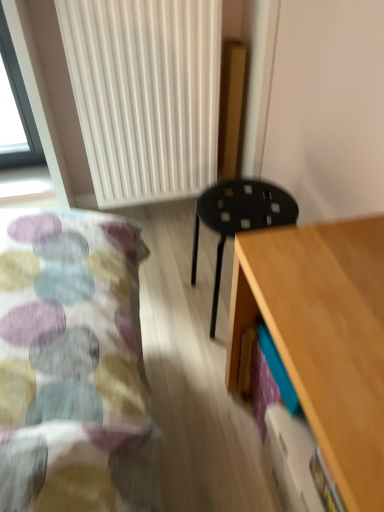
Question: Is white ribbed radiator at upper center positioned with its back to light wood desk at lower right?

Choices:
 (A) yes
 (B) no

Answer: (B)

Question: Can light wood desk at lower right be found inside white ribbed radiator at upper center?

Choices:
 (A) no
 (B) yes

Answer: (A)

Question: Does white ribbed radiator at upper center come behind light wood desk at lower right?

Choices:
 (A) no
 (B) yes

Answer: (B)

Question: Does white ribbed radiator at upper center appear on the right side of light wood desk at lower right?

Choices:
 (A) yes
 (B) no

Answer: (B)

Question: Is white ribbed radiator at upper center to the left of light wood desk at lower right from the viewer's perspective?

Choices:
 (A) no
 (B) yes

Answer: (B)

Question: From a real-world perspective, is white ribbed radiator at upper center physically located above or below light wood desk at lower right?

Choices:
 (A) below
 (B) above

Answer: (B)

Question: Is white ribbed radiator at upper center inside the boundaries of light wood desk at lower right, or outside?

Choices:
 (A) outside
 (B) inside

Answer: (A)

Question: Does point (175, 15) appear closer or farther from the camera than point (369, 343)?

Choices:
 (A) farther
 (B) closer

Answer: (A)

Question: In the image, is white ribbed radiator at upper center positioned in front of or behind light wood desk at lower right?

Choices:
 (A) behind
 (B) front

Answer: (A)

Question: Is light wood desk at lower right wider or thinner than white ribbed radiator at upper center?

Choices:
 (A) thin
 (B) wide

Answer: (B)

Question: Considering the positions of point (355, 268) and point (185, 86), is point (355, 268) closer or farther from the camera than point (185, 86)?

Choices:
 (A) farther
 (B) closer

Answer: (B)

Question: Is light wood desk at lower right situated inside white ribbed radiator at upper center or outside?

Choices:
 (A) outside
 (B) inside

Answer: (A)

Question: From the image's perspective, is light wood desk at lower right above or below white ribbed radiator at upper center?

Choices:
 (A) above
 (B) below

Answer: (B)

Question: Looking at the image, does light wood desk at lower right seem bigger or smaller compared to black plastic stool at center?

Choices:
 (A) small
 (B) big

Answer: (B)

Question: Considering the positions of light wood desk at lower right and black plastic stool at center in the image, is light wood desk at lower right taller or shorter than black plastic stool at center?

Choices:
 (A) tall
 (B) short

Answer: (A)